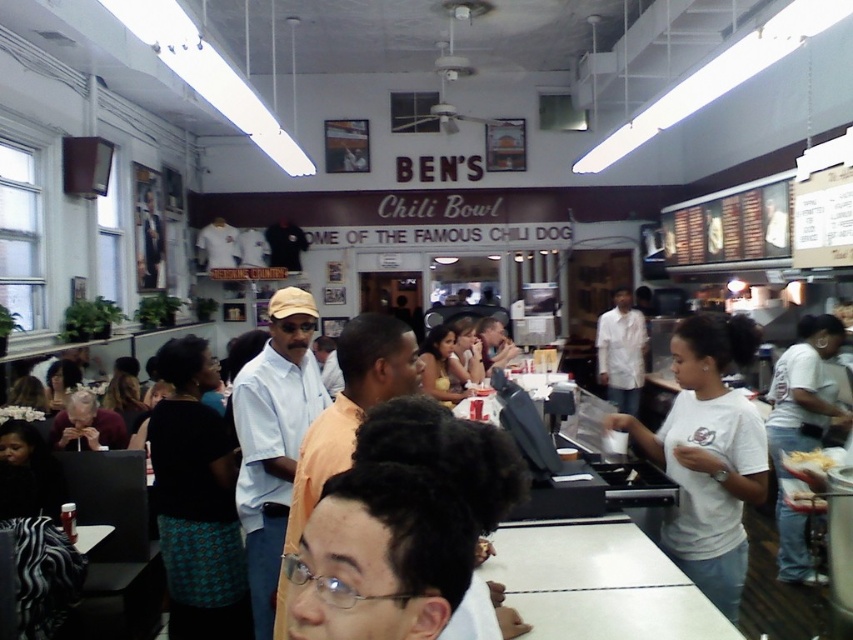
Question: Which point is closer to the camera?

Choices:
 (A) black textured skirt at center
 (B) white paper bag at center
 (C) matte white shirt at center

Answer: (A)

Question: Considering the relative positions of black textured skirt at center and white paper bag at center in the image provided, where is black textured skirt at center located with respect to white paper bag at center?

Choices:
 (A) below
 (B) above

Answer: (B)

Question: Based on their relative distances, which object is nearer to the white paper bag at center?

Choices:
 (A) black textured skirt at center
 (B) matte white shirt at center

Answer: (B)

Question: Does black textured skirt at center appear on the left side of white paper bag at center?

Choices:
 (A) no
 (B) yes

Answer: (B)

Question: Among these objects, which one is nearest to the camera?

Choices:
 (A) black textured skirt at center
 (B) white paper bag at center
 (C) matte white shirt at center

Answer: (A)

Question: Does matte white shirt at center appear over white paper bag at center?

Choices:
 (A) no
 (B) yes

Answer: (B)